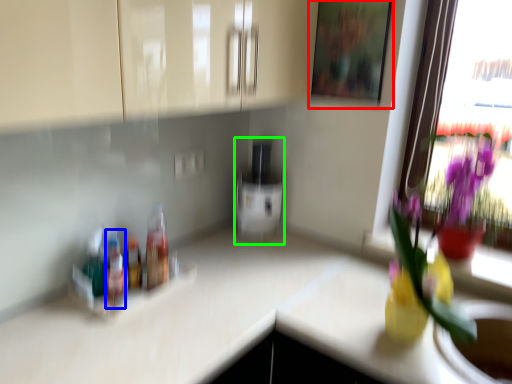
Question: Estimate the real-world distances between objects in this image. Which object is farther from picture frame (highlighted by a red box), bottle (highlighted by a blue box) or appliance (highlighted by a green box)?

Choices:
 (A) bottle
 (B) appliance

Answer: (A)